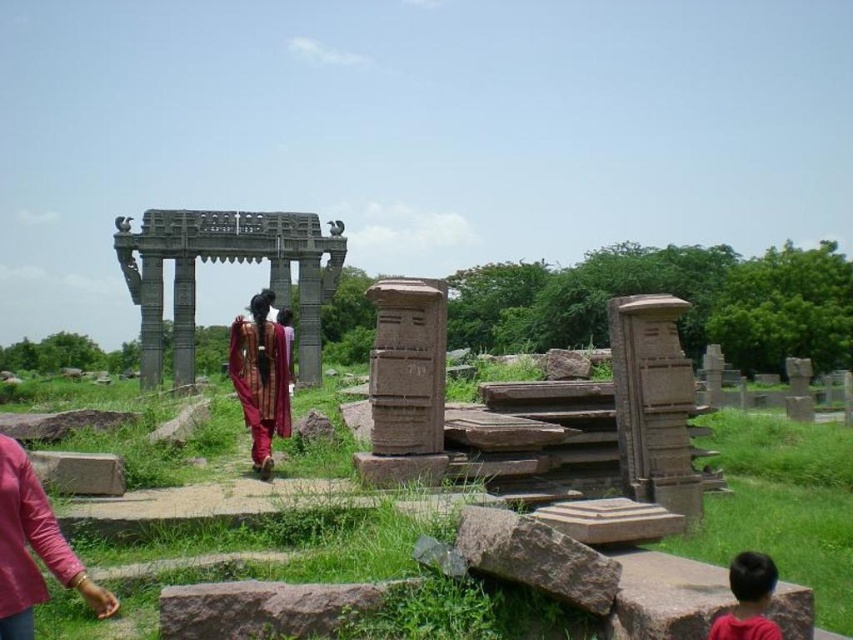
You are a tour guide explaining the clothing of historical figures to visitors. You notice the matte red robe at lower left and the maroon silk robe at center. Which robe is wider?

The matte red robe at lower left is wider than the maroon silk robe at center according to the description.

You are standing at the archaeological site and want to take a photo of both the point at (708,417) and the point at (239,342). Which point should you focus on first to ensure both are in clear view?

You should focus on the point at (708,417) first because it is closer to you than the point at (239,342), ensuring both points are in clear view.

You are standing at the archaeological site and want to visit both the matte red robe at lower left and the maroon silk robe at center. Which robe is farther from your current position?

The matte red robe at lower left is 121.60 feet away from the maroon silk robe at center, so the distance between them is 121.60 feet. Without knowing your exact position, it is impossible to determine which robe is farther away.